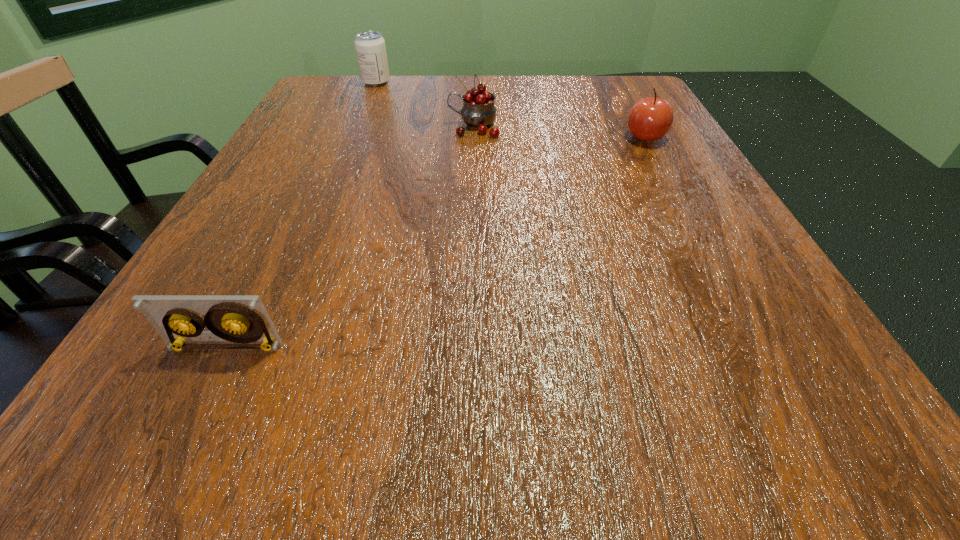
Identify the location of blank space at the far left corner. Image resolution: width=960 pixels, height=540 pixels. (355, 80).

This screenshot has width=960, height=540. Find the location of `free space at the near left corner of the desktop`. free space at the near left corner of the desktop is located at coordinates (137, 429).

In order to click on free space at the far right corner in this screenshot , I will do `click(644, 93)`.

This screenshot has height=540, width=960. Find the location of `vacant space at the near right corner of the desktop`. vacant space at the near right corner of the desktop is located at coordinates (822, 422).

Find the location of a particular element. vacant area that lies between the farthest object and the third object from left to right is located at coordinates (425, 104).

Locate an element on the screen. This screenshot has width=960, height=540. empty location between the second object from right to left and the apple is located at coordinates (560, 132).

Where is `free point between the third object from left to right and the rightmost object`? This screenshot has height=540, width=960. free point between the third object from left to right and the rightmost object is located at coordinates (560, 132).

Where is `free point between the rightmost object and the videotape`? The image size is (960, 540). free point between the rightmost object and the videotape is located at coordinates (436, 242).

What are the coordinates of `free space between the second object from right to left and the soda can` in the screenshot? It's located at (425, 104).

I want to click on vacant point located between the rightmost object and the nearest object, so click(x=436, y=242).